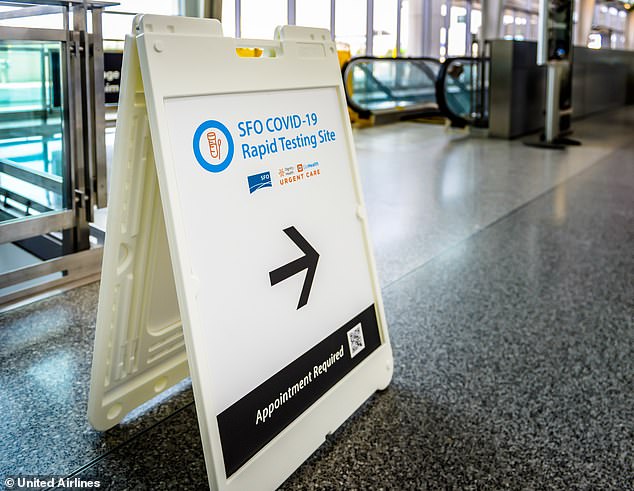
Find the location of a particular element. window is located at coordinates (387, 22).